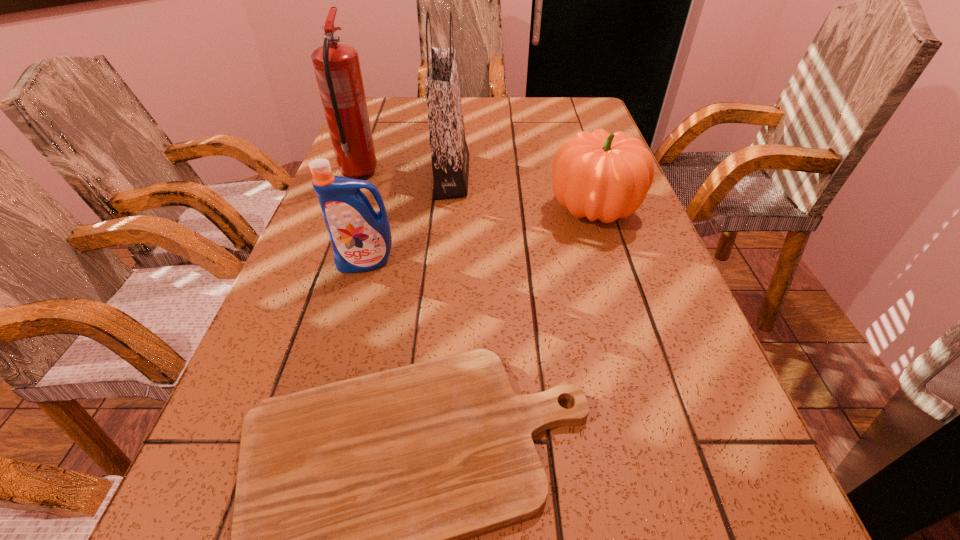
Where is `vacant space located on the back of the pumpkin`? This screenshot has width=960, height=540. vacant space located on the back of the pumpkin is located at coordinates (570, 136).

What are the coordinates of `fire extinguisher present at the left edge` in the screenshot? It's located at click(x=337, y=69).

Where is `detergent located in the left edge section of the desktop`? detergent located in the left edge section of the desktop is located at coordinates (361, 240).

Identify the location of object located at the right edge. Image resolution: width=960 pixels, height=540 pixels. (597, 175).

Identify the location of free space at the far edge. The width and height of the screenshot is (960, 540). (495, 112).

The height and width of the screenshot is (540, 960). I want to click on vacant space at the left edge of the desktop, so click(335, 370).

The width and height of the screenshot is (960, 540). In order to click on free spot at the far right corner of the desktop in this screenshot , I will do `click(583, 123)`.

The image size is (960, 540). In order to click on unoccupied position between the pumpkin and the shopping bag in this screenshot , I will do `click(522, 193)`.

What are the coordinates of `free spot between the pumpkin and the shopping bag` in the screenshot? It's located at (522, 193).

Locate an element on the screen. free space between the third shortest object and the second shortest object is located at coordinates (480, 236).